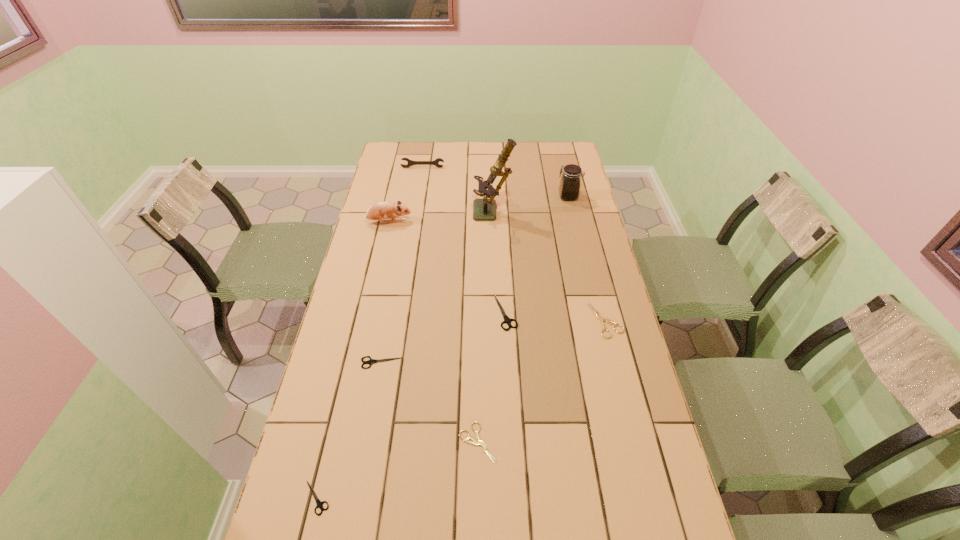
Where is `object situated at the far edge`? The image size is (960, 540). object situated at the far edge is located at coordinates (410, 162).

Find the location of a particular element. hamster situated at the left edge is located at coordinates (382, 210).

Identify the location of wrench that is at the left edge. (410, 162).

The image size is (960, 540). I want to click on jar at the right edge, so click(x=570, y=181).

Find the location of a particular element. This screenshot has height=540, width=960. shears situated at the right edge is located at coordinates (601, 319).

Where is `object situated at the far left corner`? Image resolution: width=960 pixels, height=540 pixels. object situated at the far left corner is located at coordinates (410, 162).

Identify the location of vacant space at the left edge. (409, 207).

I want to click on vacant space at the right edge, so click(582, 204).

The image size is (960, 540). Identify the location of empty space between the biggest black shears and the second nearest black shears. (444, 338).

This screenshot has height=540, width=960. What are the coordinates of `free area in between the jar and the fifth shortest object` in the screenshot? It's located at (537, 255).